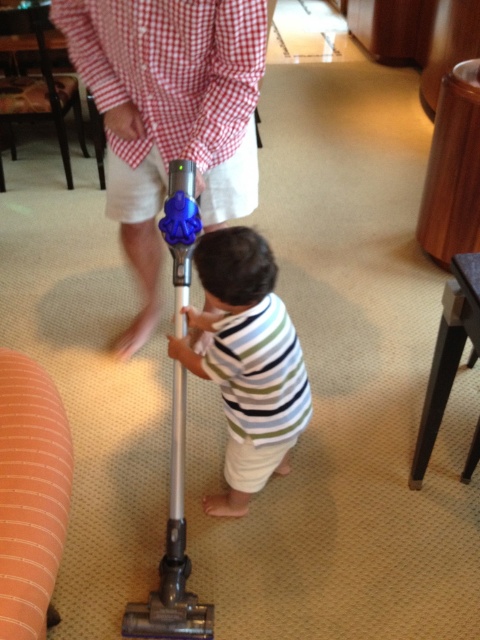
In the scene shown: Does checkered fabric shirt at upper center appear over striped cotton shirt at center?

Yes.

Can you confirm if checkered fabric shirt at upper center is wider than striped cotton shirt at center?

Correct, the width of checkered fabric shirt at upper center exceeds that of striped cotton shirt at center.

Is point (59, 19) closer to camera compared to point (236, 294)?

No, (59, 19) is behind (236, 294).

Locate an element on the screen. checkered fabric shirt at upper center is located at coordinates (170, 68).